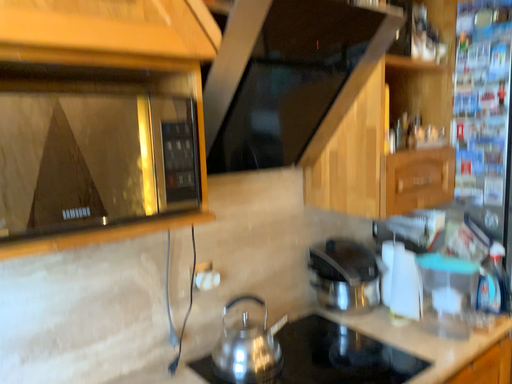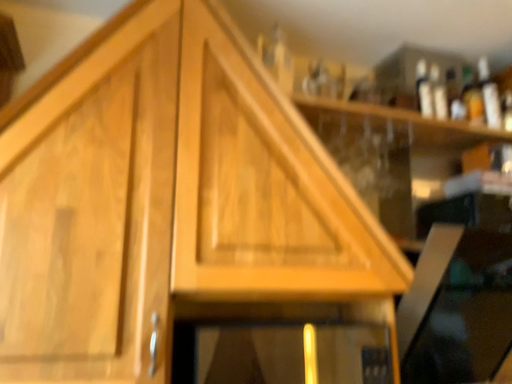
Question: Which way did the camera rotate in the video?

Choices:
 (A) rotated upward
 (B) rotated downward

Answer: (A)